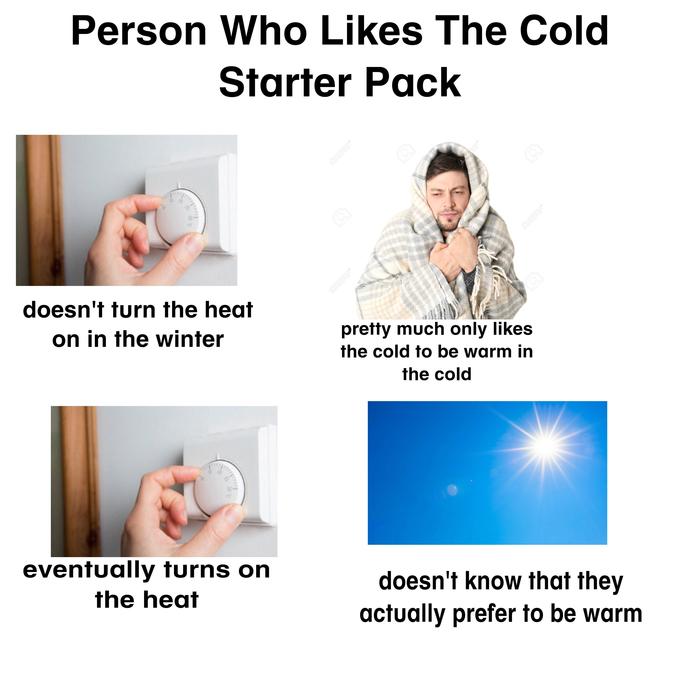
Identify the location of knob. (222, 486).